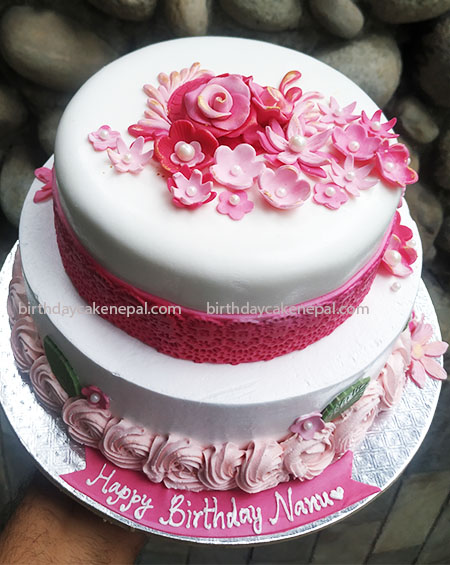
The width and height of the screenshot is (450, 565). I want to click on white round plate, so point(410,436).